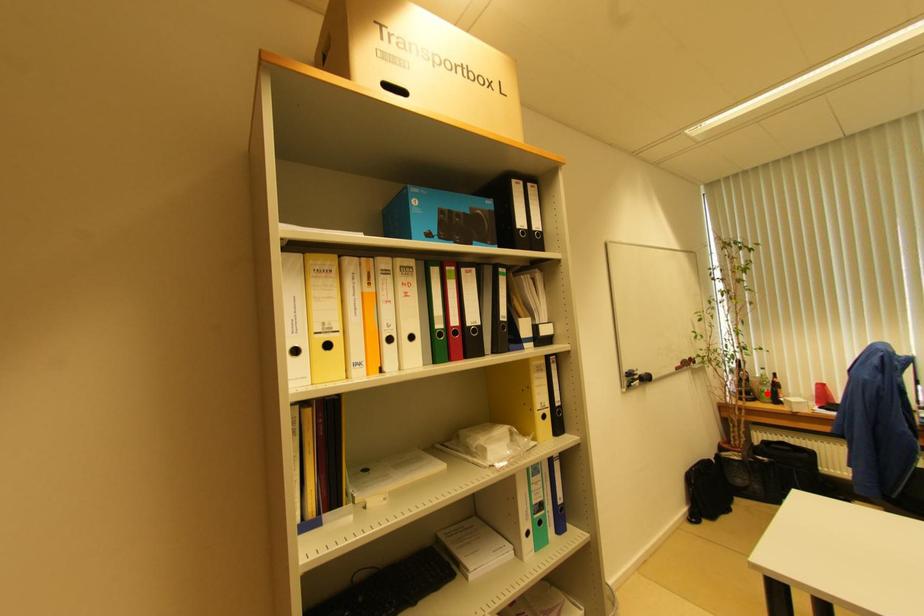
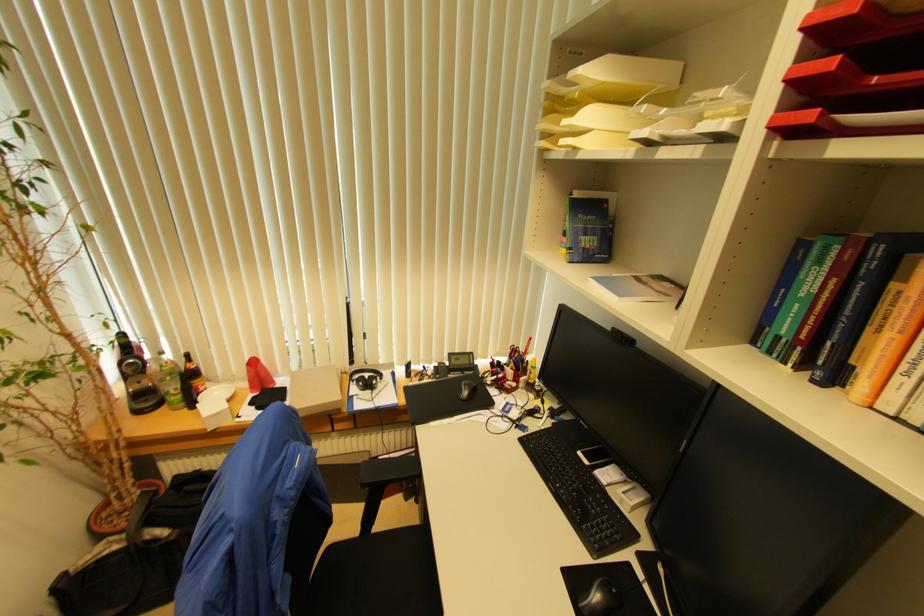
The point at the highlighted location is marked in the first image. Where is the corresponding point in the second image?

(174, 394)